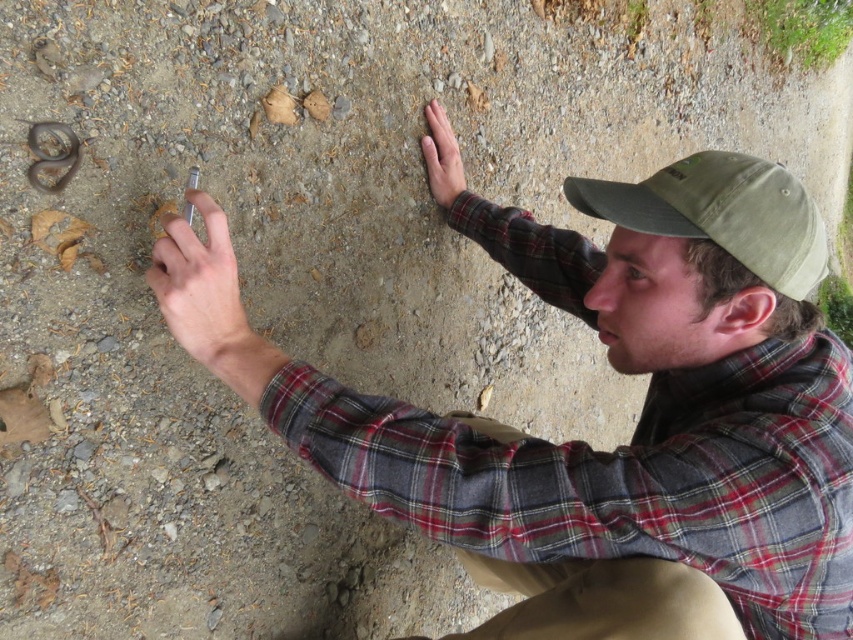
Question: Based on their relative distances, which object is nearer to the matte brown hand at upper right?

Choices:
 (A) khaki pants at lower center
 (B) green fabric baseball cap at upper right

Answer: (B)

Question: Estimate the real-world distances between objects in this image. Which object is farther from the khaki pants at lower center?

Choices:
 (A) plaid fabric at center
 (B) green fabric baseball cap at upper right
 (C) pale skin at center
 (D) matte brown hand at upper right

Answer: (D)

Question: Which point is closer to the camera?

Choices:
 (A) (524, 586)
 (B) (791, 272)
 (C) (231, 362)

Answer: (B)

Question: Is green fabric baseball cap at upper right thinner than pale skin at center?

Choices:
 (A) no
 (B) yes

Answer: (A)

Question: Can you confirm if plaid fabric at center is positioned above matte brown hand at upper right?

Choices:
 (A) no
 (B) yes

Answer: (A)

Question: Can you confirm if plaid fabric at center is positioned to the right of green fabric baseball cap at upper right?

Choices:
 (A) yes
 (B) no

Answer: (B)